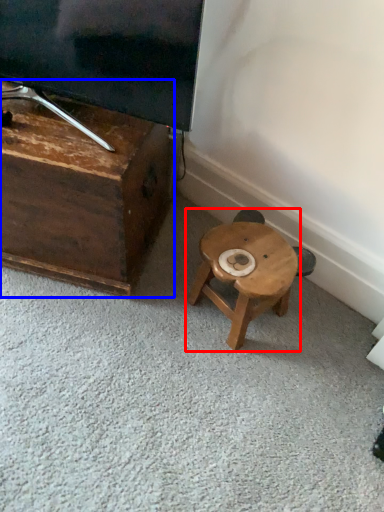
Question: Which object appears closest to the camera in this image, stool (highlighted by a red box) or furniture (highlighted by a blue box)?

Choices:
 (A) stool
 (B) furniture

Answer: (B)